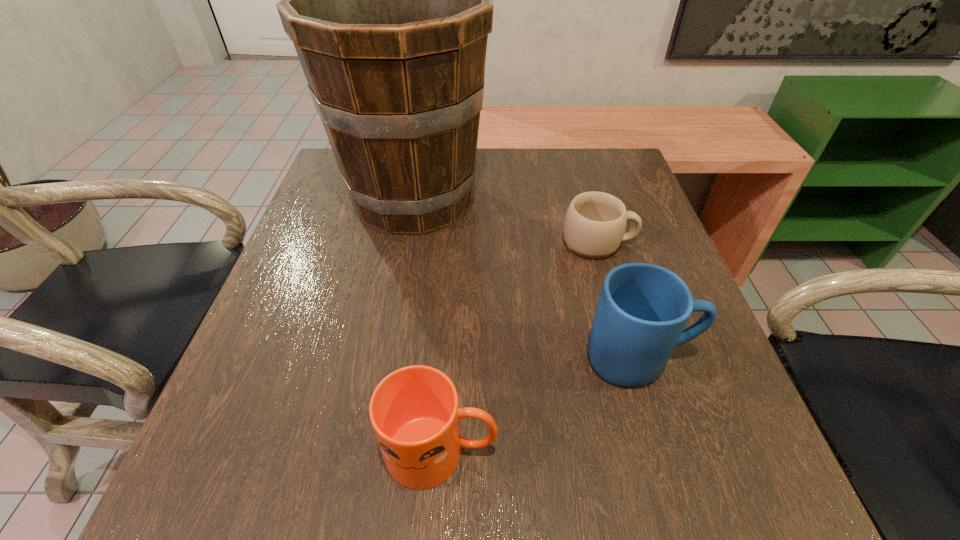
I want to click on bucket, so click(x=388, y=0).

In order to click on the third farthest object in this screenshot , I will do `click(642, 311)`.

At what (x,y) coordinates should I click in order to perform the action: click on the second farthest mug. Please return your answer as a coordinate pair (x, y). Looking at the image, I should click on (642, 311).

You are a GUI agent. You are given a task and a screenshot of the screen. Output one action in this format:
    pyautogui.click(x=<x>, y=<y>)
    Task: Click on the nearest mug
    The image size is (960, 540).
    Given the screenshot: What is the action you would take?
    pyautogui.click(x=414, y=411)

This screenshot has height=540, width=960. I want to click on the nearest object, so click(414, 411).

The width and height of the screenshot is (960, 540). In order to click on the shortest object in this screenshot , I will do `click(595, 222)`.

Find the location of a particular element. the shortest mug is located at coordinates tap(595, 222).

Image resolution: width=960 pixels, height=540 pixels. Identify the location of free space located 0.220m on the front of the bucket. (390, 330).

The image size is (960, 540). In order to click on vacant space positioned on the handle side of the nearest mug in this screenshot , I will do `click(619, 450)`.

Image resolution: width=960 pixels, height=540 pixels. What are the coordinates of `object at the far edge` in the screenshot? It's located at (388, 0).